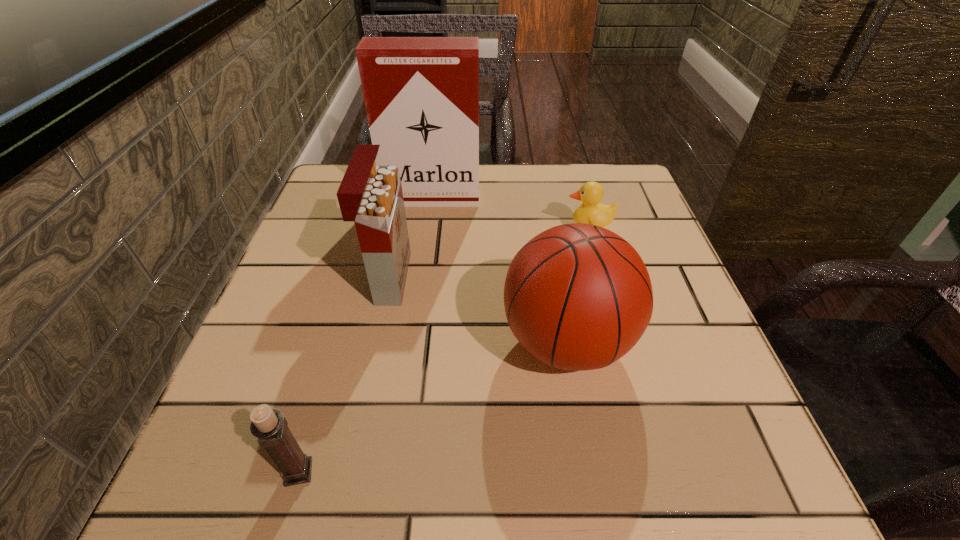
Locate an element on the screen. This screenshot has height=540, width=960. free space that satisfies the following two spatial constraints: 1. with the lid open on the shorter cigarette case; 2. on the front side of the nearest object is located at coordinates (348, 472).

Find the location of a particular element. The image size is (960, 540). vacant space that satisfies the following two spatial constraints: 1. on the front-facing side of the basketball; 2. on the left side of the farthest object is located at coordinates (413, 342).

The image size is (960, 540). What are the coordinates of `free spot that satisfies the following two spatial constraints: 1. on the front-facing side of the basketball; 2. on the left side of the farthest object` in the screenshot? It's located at (413, 342).

This screenshot has height=540, width=960. I want to click on free location that satisfies the following two spatial constraints: 1. on the front-facing side of the basketball; 2. on the right side of the tallest object, so click(413, 342).

At what (x,y) coordinates should I click in order to perform the action: click on vacant region that satisfies the following two spatial constraints: 1. with the lid open on the shorter cigarette case; 2. on the front side of the nearest object. Please return your answer as a coordinate pair (x, y). This screenshot has height=540, width=960. Looking at the image, I should click on (348, 472).

At what (x,y) coordinates should I click in order to perform the action: click on vacant space that satisfies the following two spatial constraints: 1. with the lid open on the shorter cigarette case; 2. on the left side of the basketball. Please return your answer as a coordinate pair (x, y). This screenshot has width=960, height=540. Looking at the image, I should click on (375, 342).